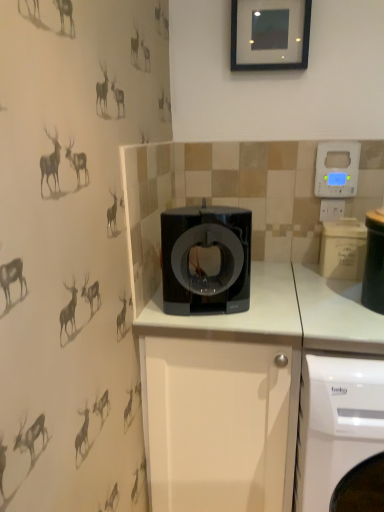
Question: From the image's perspective, relative to white plastic electric outlet at upper right, is blue plastic thermostat at upper right above or below?

Choices:
 (A) below
 (B) above

Answer: (B)

Question: Is blue plastic thermostat at upper right wider or thinner than white plastic electric outlet at upper right?

Choices:
 (A) wide
 (B) thin

Answer: (A)

Question: Which is nearer to the blue plastic thermostat at upper right?

Choices:
 (A) black plastic container at right
 (B) white matte cabinet at center
 (C) black glossy coffee machine at center
 (D) white plastic electric outlet at upper right
 (E) white glossy washing machine at lower right

Answer: (D)

Question: Based on their relative distances, which object is farther from the white glossy washing machine at lower right?

Choices:
 (A) black glossy picture frame at upper center
 (B) white matte cabinet at center
 (C) white plastic electric outlet at upper right
 (D) black glossy coffee machine at center
 (E) black plastic container at right

Answer: (A)